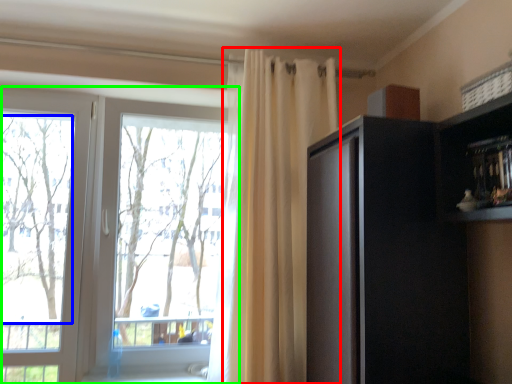
Question: Estimate the real-world distances between objects in this image. Which object is farther from curtain (highlighted by a red box), tree (highlighted by a blue box) or window (highlighted by a green box)?

Choices:
 (A) tree
 (B) window

Answer: (A)